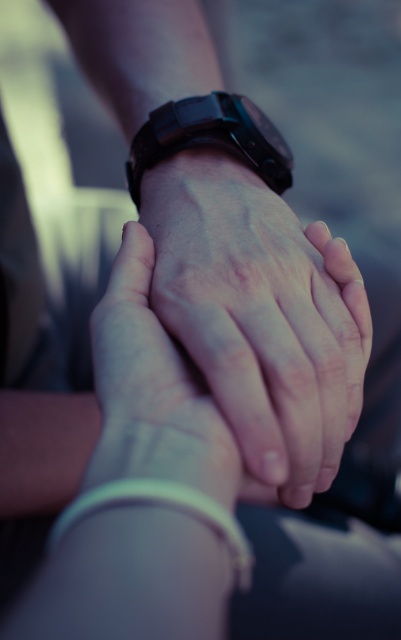
Question: From the image, what is the correct spatial relationship of matte black watch at center in relation to black matte watch at center?

Choices:
 (A) left
 (B) right

Answer: (B)

Question: Which point is farther to the camera?

Choices:
 (A) matte black watch at center
 (B) white matte bracelet at lower center

Answer: (A)

Question: Which point is closer to the camera?

Choices:
 (A) black matte watch at center
 (B) white matte bracelet at lower center
 (C) matte black watch at center

Answer: (B)

Question: Is matte black watch at center behind black matte watch at center?

Choices:
 (A) yes
 (B) no

Answer: (B)

Question: Is matte black watch at center to the right of white matte bracelet at lower center from the viewer's perspective?

Choices:
 (A) no
 (B) yes

Answer: (B)

Question: Which point is closer to the camera?

Choices:
 (A) white matte bracelet at lower center
 (B) black matte watch at center
 (C) matte black watch at center

Answer: (A)